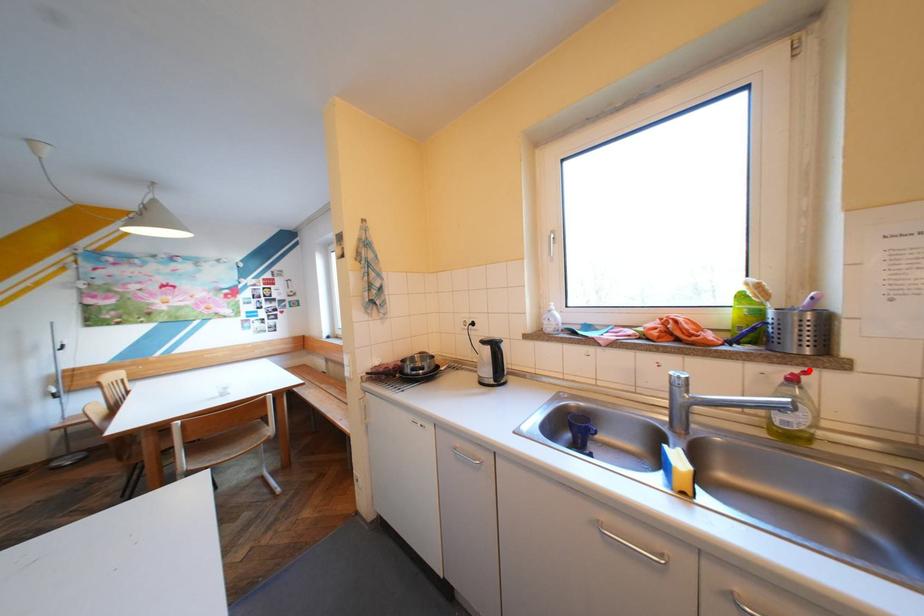
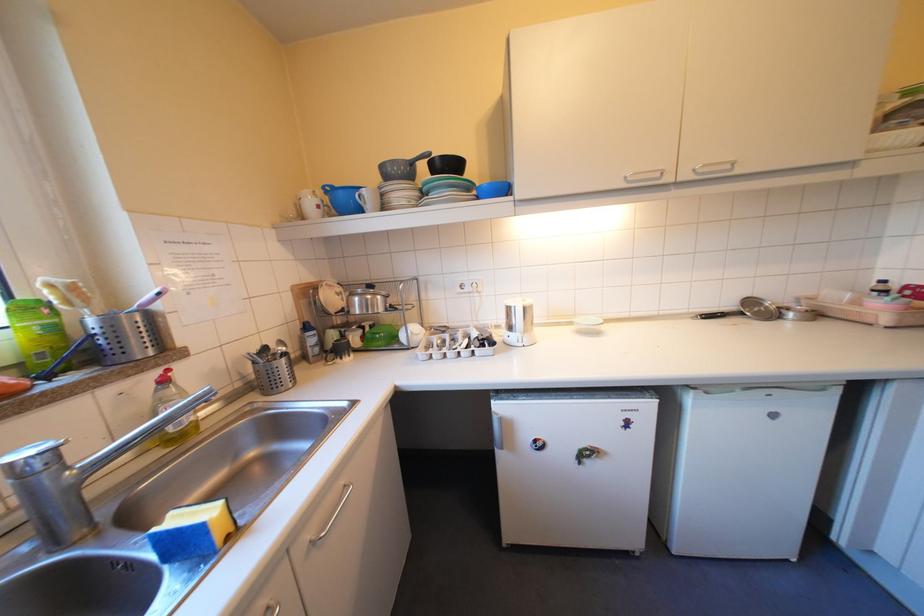
Find the pixel in the second image that matches the highlighted location in the first image.

(168, 371)